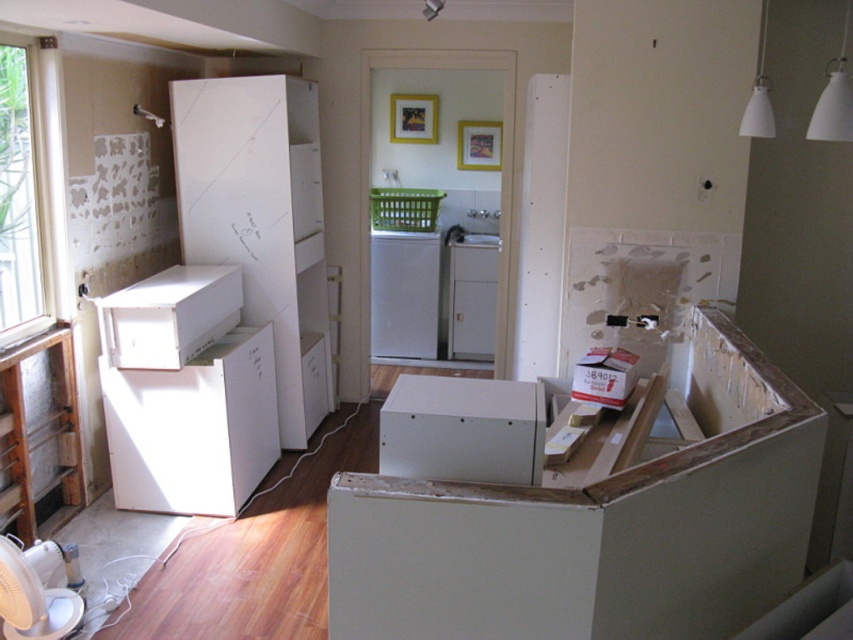
Question: Can you confirm if white matte cardboard box at center is thinner than white matte refrigerator at center?

Choices:
 (A) yes
 (B) no

Answer: (A)

Question: Which of these objects is positioned farthest from the white matte refrigerator at center?

Choices:
 (A) white matte cardboard box at center
 (B) white cardboard box at center
 (C) white glossy refrigerator at center

Answer: (A)

Question: Which object is positioned farthest from the white matte refrigerator at center?

Choices:
 (A) white cardboard box at center
 (B) white glossy refrigerator at center

Answer: (A)

Question: Which point is farther to the camera?

Choices:
 (A) white matte refrigerator at center
 (B) white glossy refrigerator at center

Answer: (B)

Question: Does white matte cardboard box at center appear on the left side of white cardboard box at center?

Choices:
 (A) no
 (B) yes

Answer: (B)

Question: Does white matte refrigerator at center appear under white cardboard box at center?

Choices:
 (A) no
 (B) yes

Answer: (A)